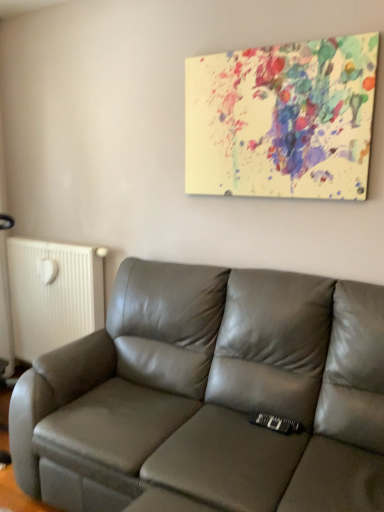
Question: Should I look upward or downward to see satin gray leather couch at center?

Choices:
 (A) down
 (B) up

Answer: (A)

Question: Could you tell me if satin gray leather couch at center is turned towards white matte radiator at left?

Choices:
 (A) yes
 (B) no

Answer: (B)

Question: Considering the relative positions of satin gray leather couch at center and white matte radiator at left in the image provided, is satin gray leather couch at center to the right of white matte radiator at left from the viewer's perspective?

Choices:
 (A) yes
 (B) no

Answer: (A)

Question: Is satin gray leather couch at center behind white matte radiator at left?

Choices:
 (A) yes
 (B) no

Answer: (B)

Question: Can you confirm if satin gray leather couch at center is smaller than white matte radiator at left?

Choices:
 (A) yes
 (B) no

Answer: (B)

Question: From a real-world perspective, does satin gray leather couch at center stand above white matte radiator at left?

Choices:
 (A) no
 (B) yes

Answer: (A)

Question: From the image's perspective, would you say satin gray leather couch at center is shown under white matte radiator at left?

Choices:
 (A) yes
 (B) no

Answer: (A)

Question: Is white matte radiator at left aimed at paint splatter canvas at upper center?

Choices:
 (A) yes
 (B) no

Answer: (B)

Question: Is white matte radiator at left positioned with its back to paint splatter canvas at upper center?

Choices:
 (A) no
 (B) yes

Answer: (A)

Question: Considering the relative positions of white matte radiator at left and paint splatter canvas at upper center in the image provided, is white matte radiator at left to the left of paint splatter canvas at upper center from the viewer's perspective?

Choices:
 (A) yes
 (B) no

Answer: (A)

Question: Can you confirm if white matte radiator at left is taller than paint splatter canvas at upper center?

Choices:
 (A) yes
 (B) no

Answer: (A)

Question: Does white matte radiator at left have a smaller size compared to paint splatter canvas at upper center?

Choices:
 (A) no
 (B) yes

Answer: (A)

Question: Can paint splatter canvas at upper center be found inside white matte radiator at left?

Choices:
 (A) no
 (B) yes

Answer: (A)

Question: Can you confirm if paint splatter canvas at upper center is smaller than satin gray leather couch at center?

Choices:
 (A) yes
 (B) no

Answer: (A)